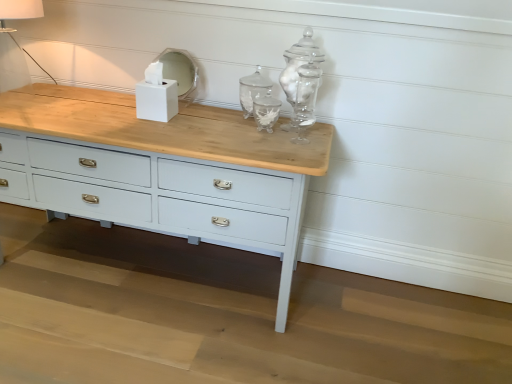
Question: Does white matte tissue box at center have a larger size compared to white glossy mirror at upper center?

Choices:
 (A) no
 (B) yes

Answer: (B)

Question: Does white matte tissue box at center come in front of white glossy mirror at upper center?

Choices:
 (A) no
 (B) yes

Answer: (B)

Question: Could you tell me if white matte tissue box at center is turned towards white glossy mirror at upper center?

Choices:
 (A) yes
 (B) no

Answer: (B)

Question: Are white matte tissue box at center and white glossy mirror at upper center beside each other?

Choices:
 (A) yes
 (B) no

Answer: (B)

Question: Does white matte tissue box at center have a greater height compared to white glossy mirror at upper center?

Choices:
 (A) yes
 (B) no

Answer: (B)

Question: Would you say white matte tissue box at center is outside white glossy mirror at upper center?

Choices:
 (A) yes
 (B) no

Answer: (A)

Question: From a real-world perspective, is white glossy mirror at upper center on top of white fabric lampshade at upper left?

Choices:
 (A) yes
 (B) no

Answer: (B)

Question: From the image's perspective, is white glossy mirror at upper center located beneath white fabric lampshade at upper left?

Choices:
 (A) no
 (B) yes

Answer: (B)

Question: Is white glossy mirror at upper center far away from white fabric lampshade at upper left?

Choices:
 (A) no
 (B) yes

Answer: (A)

Question: Is white glossy mirror at upper center further to the viewer compared to white fabric lampshade at upper left?

Choices:
 (A) no
 (B) yes

Answer: (B)

Question: Is white glossy mirror at upper center shorter than white fabric lampshade at upper left?

Choices:
 (A) yes
 (B) no

Answer: (A)

Question: Is white glossy mirror at upper center at the left side of white fabric lampshade at upper left?

Choices:
 (A) yes
 (B) no

Answer: (B)

Question: Is white matte tissue box at center surrounded by white fabric lampshade at upper left?

Choices:
 (A) yes
 (B) no

Answer: (B)